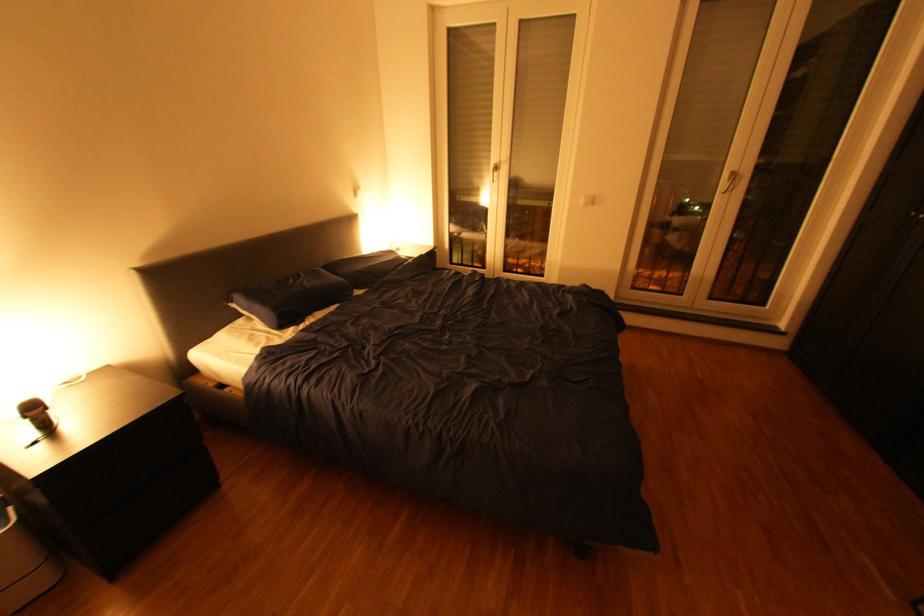
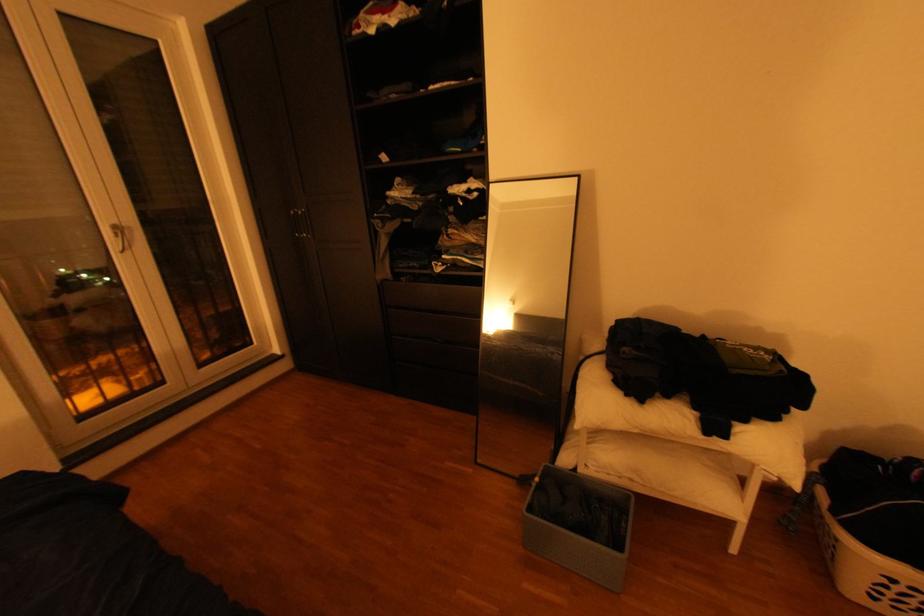
The first image is from the beginning of the video and the second image is from the end. How did the camera likely rotate when shooting the video?

The rotation direction of the camera is right-down.